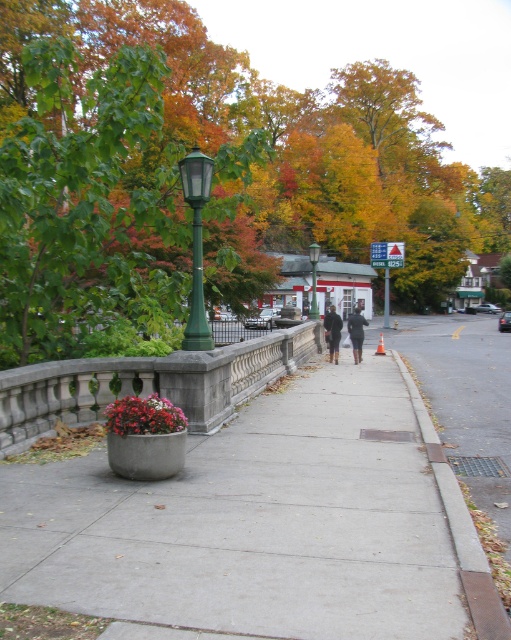
Does point (323, 321) come closer to viewer compared to point (358, 349)?

No, (323, 321) is further to viewer.

Is dark brown leather boots at center thinner than dark gray coat at center?

Indeed, dark brown leather boots at center has a lesser width compared to dark gray coat at center.

This screenshot has height=640, width=511. Identify the location of dark brown leather boots at center. (333, 332).

Based on the photo, how distant is green leafy tree at upper left from green metal pole at center?

55.86 feet

In the scene shown: Who is lower down, green leafy tree at upper left or green metal pole at center?

green metal pole at center is below.

Who is more distant from viewer, (41,209) or (386,307)?

The point (386,307) is more distant.

At what (x,y) coordinates should I click in order to perform the action: click on green leafy tree at upper left. Please return your answer as a coordinate pair (x, y). The height and width of the screenshot is (640, 511). Looking at the image, I should click on (214, 176).

Who is shorter, gray concrete curb at lower right or dark brown leather jacket at center?

gray concrete curb at lower right is shorter.

What do you see at coordinates (459, 528) in the screenshot? This screenshot has width=511, height=640. I see `gray concrete curb at lower right` at bounding box center [459, 528].

The image size is (511, 640). In order to click on gray concrete curb at lower right in this screenshot , I will do `click(459, 528)`.

Find the location of a particular element. gray concrete curb at lower right is located at coordinates (459, 528).